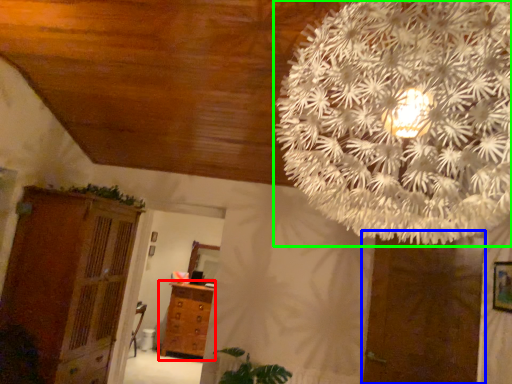
Question: Which object is positioned closest to chest of drawers (highlighted by a red box)? Select from door (highlighted by a blue box) and flower (highlighted by a green box).

Choices:
 (A) door
 (B) flower

Answer: (A)